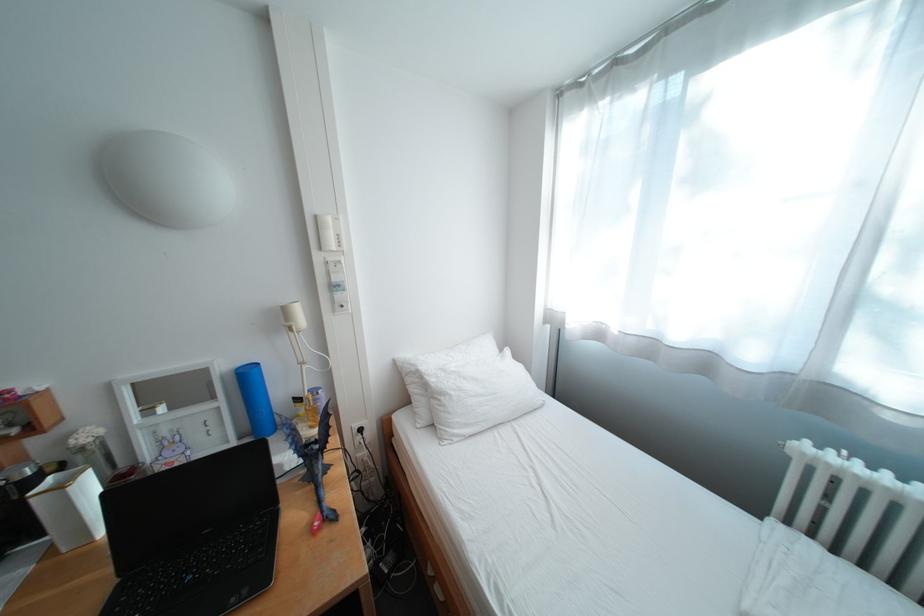
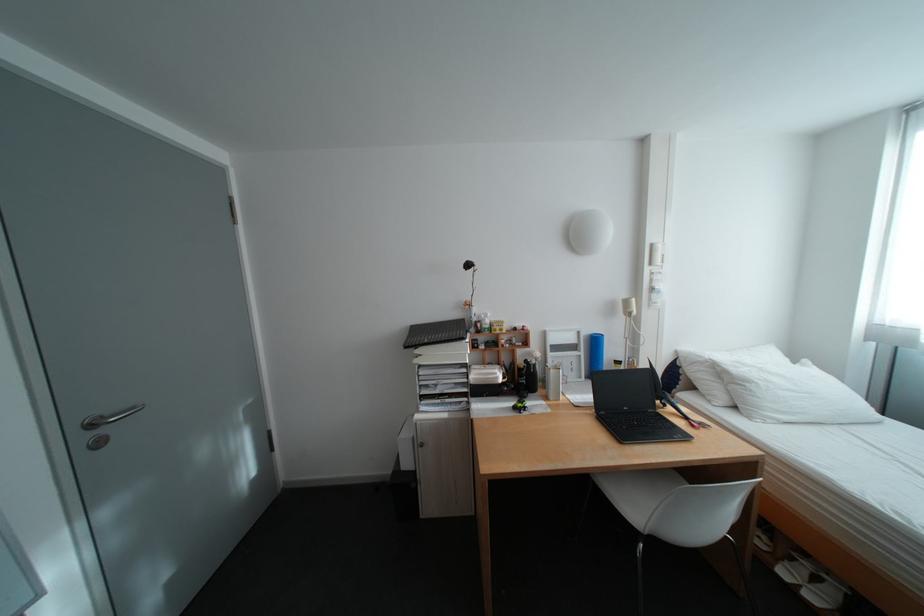
The point at (103, 440) is marked in the first image. Where is the corresponding point in the second image?

(552, 358)